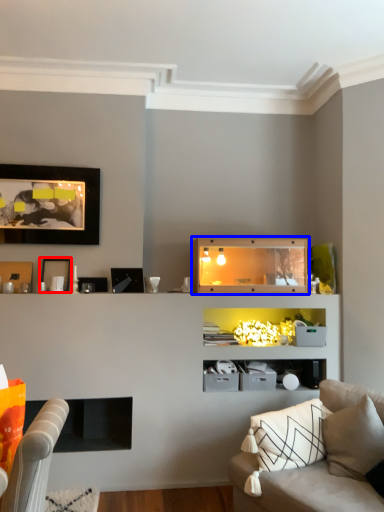
Question: Which point is closer to the camera, picture frame (highlighted by a red box) or shelf (highlighted by a blue box)?

Choices:
 (A) picture frame
 (B) shelf

Answer: (B)